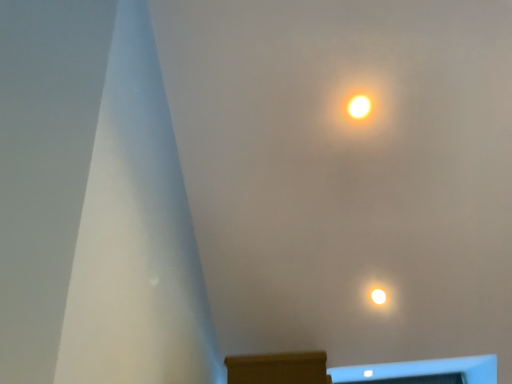
Question: From the image's perspective, is bright yellow bulb at upper center below brown wood mantle at lower center?

Choices:
 (A) no
 (B) yes

Answer: (A)

Question: Is bright yellow bulb at upper center at the right side of brown wood mantle at lower center?

Choices:
 (A) no
 (B) yes

Answer: (B)

Question: Can you confirm if bright yellow bulb at upper center is shorter than brown wood mantle at lower center?

Choices:
 (A) yes
 (B) no

Answer: (B)

Question: Is bright yellow bulb at upper center wider than brown wood mantle at lower center?

Choices:
 (A) yes
 (B) no

Answer: (B)

Question: Is bright yellow bulb at upper center bigger than brown wood mantle at lower center?

Choices:
 (A) yes
 (B) no

Answer: (B)

Question: Is bright yellow bulb at upper center facing towards brown wood mantle at lower center?

Choices:
 (A) no
 (B) yes

Answer: (A)

Question: Can you confirm if brown wood mantle at lower center is bigger than bright yellow bulb at upper center?

Choices:
 (A) yes
 (B) no

Answer: (A)

Question: From a real-world perspective, is brown wood mantle at lower center below bright yellow bulb at upper center?

Choices:
 (A) no
 (B) yes

Answer: (B)

Question: Is brown wood mantle at lower center closer to the viewer compared to bright yellow bulb at upper center?

Choices:
 (A) yes
 (B) no

Answer: (A)

Question: Is brown wood mantle at lower center looking in the opposite direction of bright yellow bulb at upper center?

Choices:
 (A) no
 (B) yes

Answer: (A)

Question: Is brown wood mantle at lower center at the right side of bright yellow bulb at upper center?

Choices:
 (A) yes
 (B) no

Answer: (B)

Question: From the image's perspective, is brown wood mantle at lower center below bright yellow bulb at upper center?

Choices:
 (A) no
 (B) yes

Answer: (B)

Question: Is point (351, 102) positioned closer to the camera than point (322, 355)?

Choices:
 (A) closer
 (B) farther

Answer: (B)